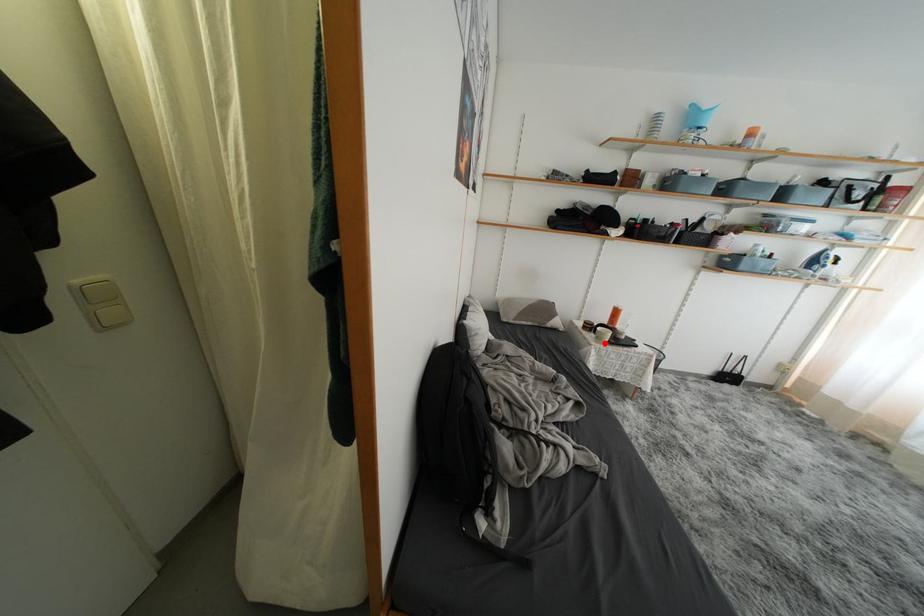
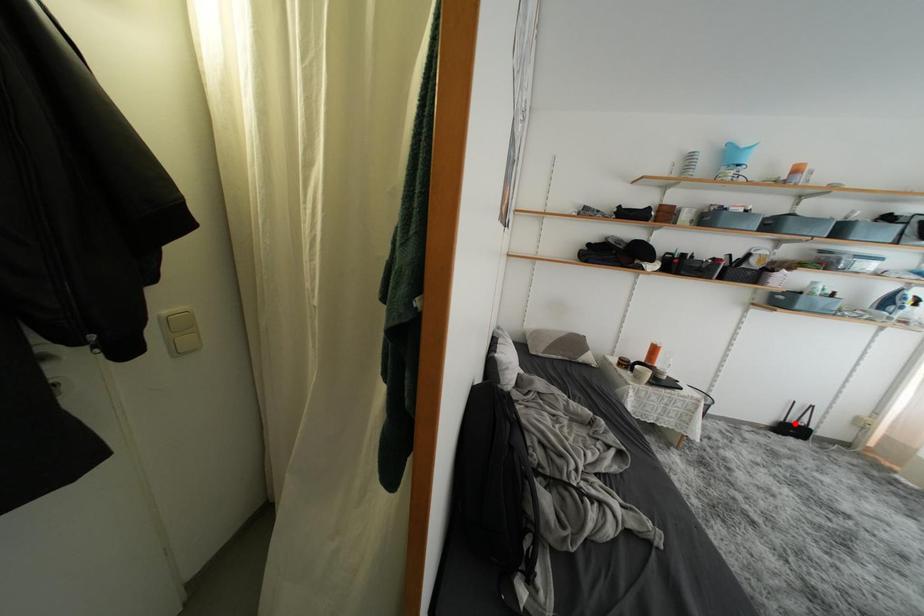
I am providing you with two images of the same scene from different viewpoints. A red point is marked on the first image and another point is marked on the second image. Are the points marked in image1 and image2 representing the same 3D position?

No